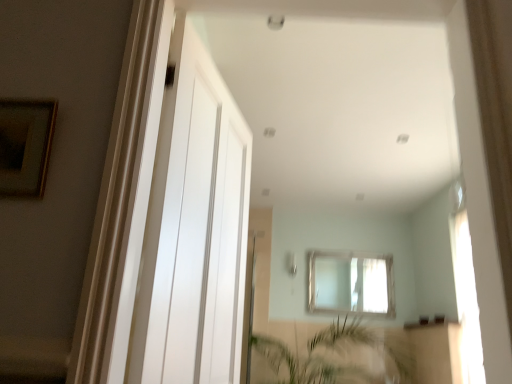
In order to click on green leafy plant at lower center in this screenshot , I will do `click(337, 355)`.

The width and height of the screenshot is (512, 384). What do you see at coordinates (337, 355) in the screenshot?
I see `green leafy plant at lower center` at bounding box center [337, 355].

Describe the element at coordinates (194, 230) in the screenshot. The image size is (512, 384). I see `white glossy door at center` at that location.

At what (x,y) coordinates should I click in order to perform the action: click on black glass window sill at lower center. Please return your answer as a coordinate pair (x, y). Looking at the image, I should click on (428, 324).

Between wooden framed picture at upper left and white glossy door at center, which one has larger size?

white glossy door at center is bigger.

In the scene shown: Is wooden framed picture at upper left not close to white glossy door at center?

No, there isn't a large distance between wooden framed picture at upper left and white glossy door at center.

Between wooden framed picture at upper left and white glossy door at center, which one is positioned in front?

white glossy door at center.

How different are the orientations of green leafy plant at lower center and white glossy door at center in degrees?

The facing directions of green leafy plant at lower center and white glossy door at center are 73.9 degrees apart.

How distant is green leafy plant at lower center from white glossy door at center?

They are 2.82 meters apart.

Is green leafy plant at lower center inside the boundaries of white glossy door at center, or outside?

green leafy plant at lower center cannot be found inside white glossy door at center.

In terms of size, does green leafy plant at lower center appear bigger or smaller than white glossy door at center?

In the image, green leafy plant at lower center appears to be larger than white glossy door at center.

Would you say black glass window sill at lower center is part of green leafy plant at lower center's contents?

No, black glass window sill at lower center is not a part of green leafy plant at lower center.

Which object is positioned more to the right, green leafy plant at lower center or black glass window sill at lower center?

Positioned to the right is black glass window sill at lower center.

Is green leafy plant at lower center closer to the viewer compared to black glass window sill at lower center?

Yes.

Is white glossy door at center to the left or to the right of clear glass window at center in the image?

From the image, it's evident that white glossy door at center is to the left of clear glass window at center.

Is white glossy door at center next to clear glass window at center and touching it?

white glossy door at center and clear glass window at center are not in contact.

Where is `screen door in front of the clear glass window at center`? The image size is (512, 384). screen door in front of the clear glass window at center is located at coordinates (194, 230).

Is white glossy door at center inside the boundaries of clear glass window at center, or outside?

white glossy door at center exists outside the volume of clear glass window at center.

Can you confirm if clear glass window at center is positioned to the left of white glossy door at center?

In fact, clear glass window at center is to the right of white glossy door at center.

How much distance is there between clear glass window at center and white glossy door at center?

They are 10.31 feet apart.

Is clear glass window at center far from white glossy door at center?

Yes, clear glass window at center and white glossy door at center are quite far apart.

Which is closer to the camera, (x=370, y=280) or (x=176, y=113)?

Point (x=176, y=113)

From a real-world perspective, is wooden framed picture at upper left positioned under green leafy plant at lower center based on gravity?

Actually, wooden framed picture at upper left is physically above green leafy plant at lower center in the real world.

Is point (41, 163) positioned before point (362, 374)?

Yes, it is.

Where is `vegetation directly beneath the wooden framed picture at upper left (from a real-world perspective)`? The image size is (512, 384). vegetation directly beneath the wooden framed picture at upper left (from a real-world perspective) is located at coordinates (337, 355).

Is wooden framed picture at upper left with green leafy plant at lower center?

wooden framed picture at upper left is not next to green leafy plant at lower center, and they're not touching.

Based on the photo, does clear glass window at center appear on the left side of green leafy plant at lower center?

In fact, clear glass window at center is to the right of green leafy plant at lower center.

From the image's perspective, who appears lower, clear glass window at center or green leafy plant at lower center?

green leafy plant at lower center is shown below in the image.

Considering the positions of points (372, 302) and (356, 349), is point (372, 302) farther from camera compared to point (356, 349)?

Yes, point (372, 302) is farther from viewer.

Is clear glass window at center further to camera compared to green leafy plant at lower center?

Yes, it is.

Locate an element on the screen. picture frame above the white glossy door at center (from a real-world perspective) is located at coordinates (25, 146).

You are a GUI agent. You are given a task and a screenshot of the screen. Output one action in this format:
    pyautogui.click(x=<x>, y=<y>)
    Task: Click on the screen door located above the green leafy plant at lower center (from the image's perspective)
    The width and height of the screenshot is (512, 384).
    Given the screenshot: What is the action you would take?
    pyautogui.click(x=194, y=230)

Consider the image. Which object lies nearer to the anchor point green leafy plant at lower center, clear glass window at center or black glass window sill at lower center?

clear glass window at center is positioned closer to the anchor green leafy plant at lower center.

Based on their spatial positions, is black glass window sill at lower center or white glossy door at center further from clear glass window at center?

Among the two, white glossy door at center is located further to clear glass window at center.

When comparing their distances from wooden framed picture at upper left, does black glass window sill at lower center or white glossy door at center seem further?

black glass window sill at lower center.

Considering their positions, is white glossy door at center positioned closer to black glass window sill at lower center than wooden framed picture at upper left?

white glossy door at center.

From the picture: From the image, which object appears to be nearer to clear glass window at center, black glass window sill at lower center or wooden framed picture at upper left?

black glass window sill at lower center is closer to clear glass window at center.

Which object lies further to the anchor point white glossy door at center, wooden framed picture at upper left or black glass window sill at lower center?

black glass window sill at lower center.

Looking at the image, which one is located further to white glossy door at center, green leafy plant at lower center or black glass window sill at lower center?

green leafy plant at lower center is further to white glossy door at center.

From the picture: Which object lies nearer to the anchor point black glass window sill at lower center, wooden framed picture at upper left or clear glass window at center?

clear glass window at center is positioned closer to the anchor black glass window sill at lower center.

At what (x,y) coordinates should I click in order to perform the action: click on window sill between wooden framed picture at upper left and clear glass window at center in the front-back direction. Please return your answer as a coordinate pair (x, y). The height and width of the screenshot is (384, 512). Looking at the image, I should click on (428, 324).

Locate an element on the screen. This screenshot has height=384, width=512. picture frame located between white glossy door at center and clear glass window at center in the depth direction is located at coordinates (25, 146).

Find the location of `vegetation between white glossy door at center and black glass window sill at lower center from front to back`. vegetation between white glossy door at center and black glass window sill at lower center from front to back is located at coordinates (337, 355).

The width and height of the screenshot is (512, 384). Identify the location of vegetation located between wooden framed picture at upper left and black glass window sill at lower center in the depth direction. click(337, 355).